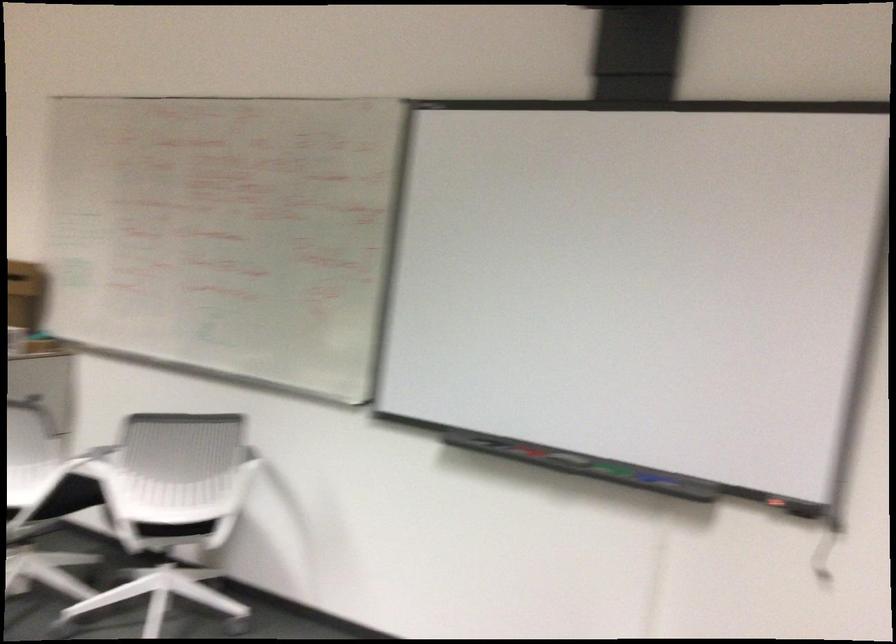
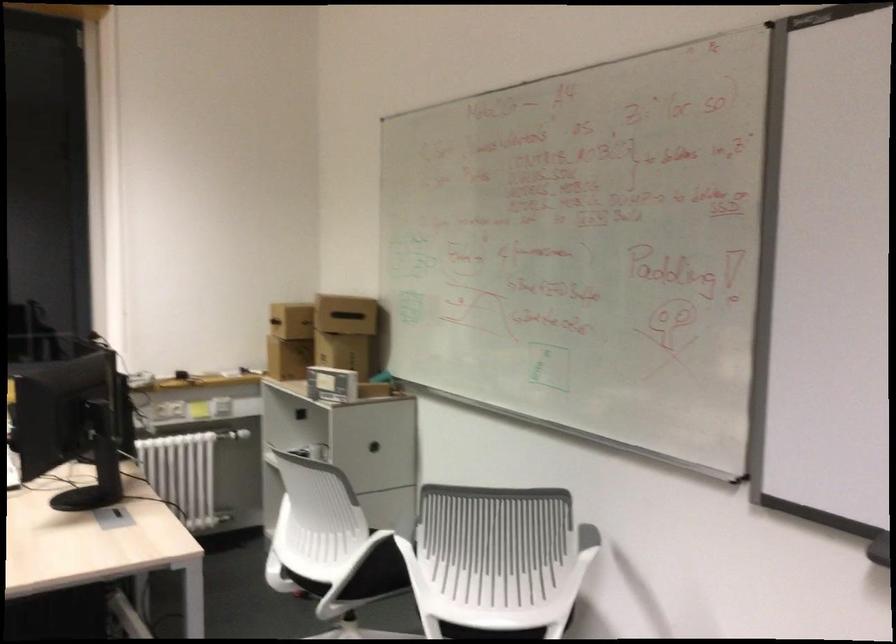
Question: The images are taken continuously from a first-person perspective. In which direction is your viewpoint rotating?

Choices:
 (A) Left
 (B) Right
 (C) Up
 (D) Down

Answer: (A)